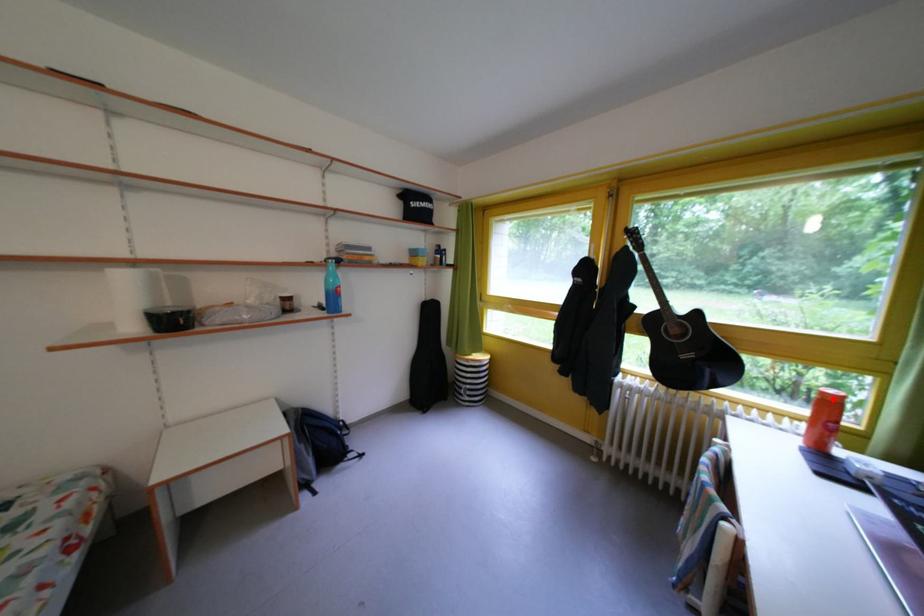
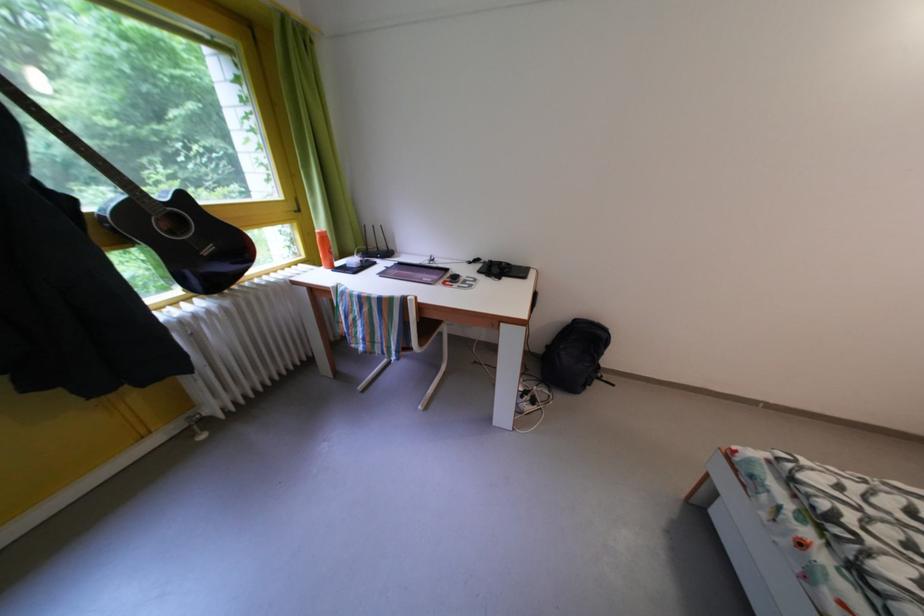
Question: I am providing you with two images of the same scene from different viewpoints. Given a red point in image1, look at the same physical point in image2. Is it:

Choices:
 (A) Closer to the viewpoint
 (B) Farther from the viewpoint

Answer: (A)